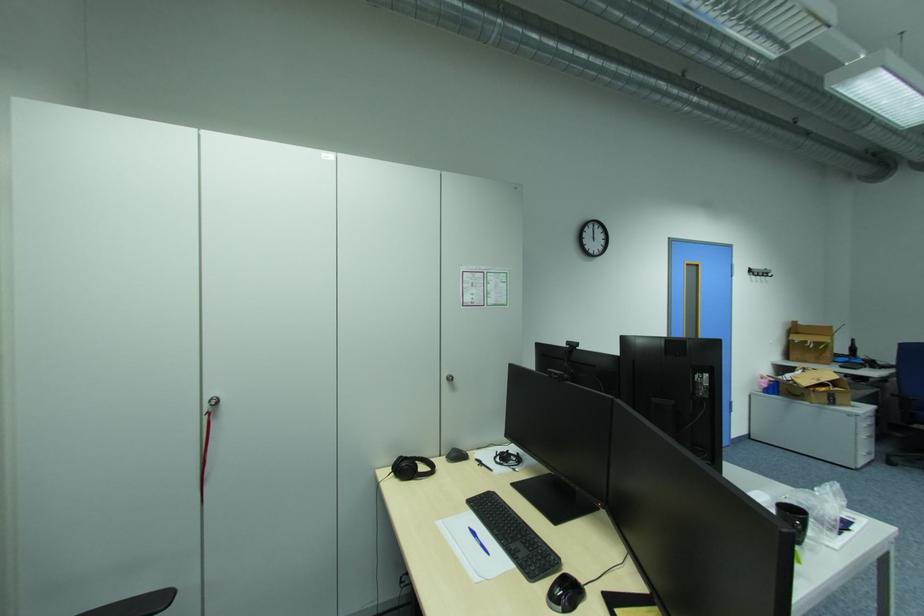
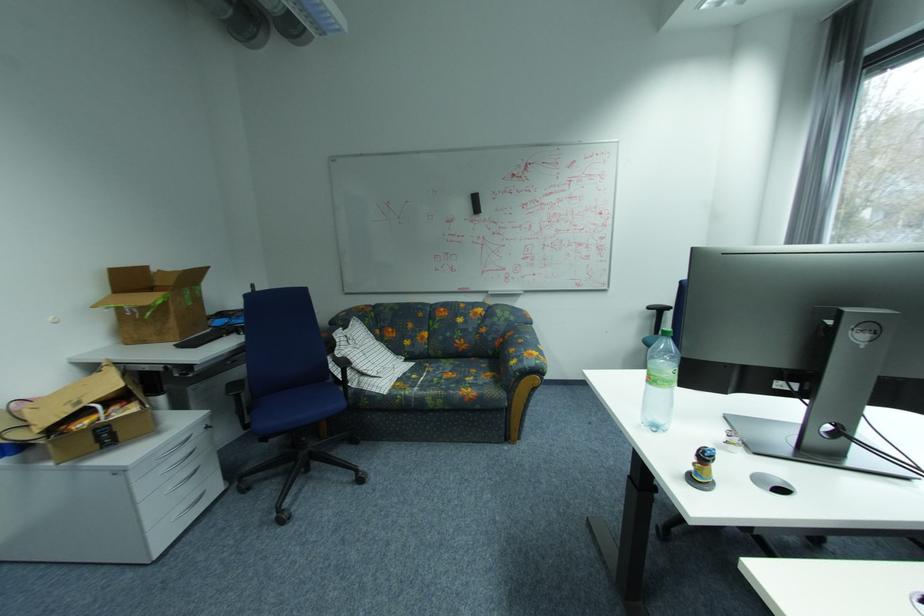
Find the pixel in the second image that matches [837,355] in the first image.

(180, 323)